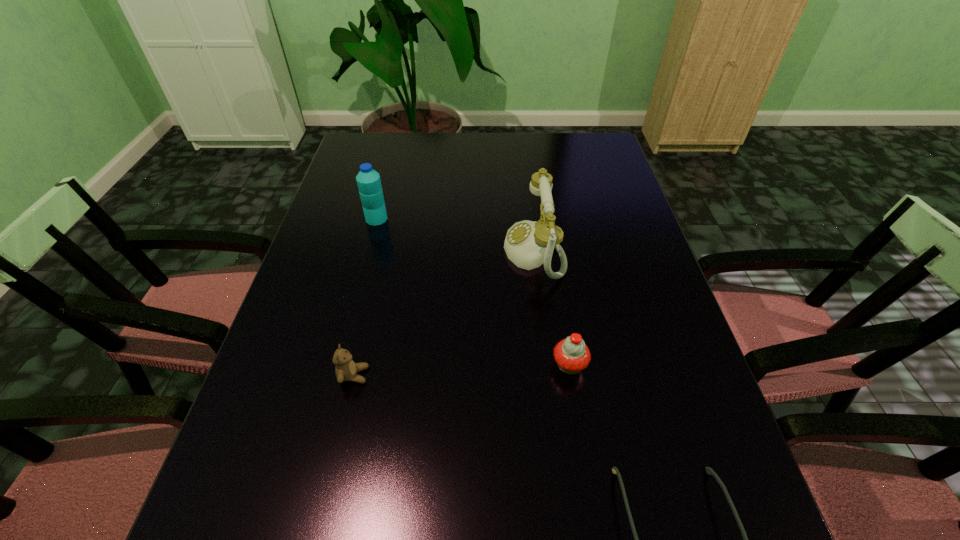
Image resolution: width=960 pixels, height=540 pixels. I want to click on water bottle that is positioned at the left edge, so click(x=368, y=180).

What are the coordinates of `teddy bear at the left edge` in the screenshot? It's located at (346, 369).

You are a GUI agent. You are given a task and a screenshot of the screen. Output one action in this format:
    pyautogui.click(x=<x>, y=<y>)
    Task: Click on the vacant space at the far edge of the desktop
    The image size is (960, 540).
    Given the screenshot: What is the action you would take?
    pyautogui.click(x=495, y=144)

The image size is (960, 540). Identify the location of free space at the left edge of the desktop. (353, 283).

The width and height of the screenshot is (960, 540). I want to click on vacant position at the right edge of the desktop, so point(621,193).

This screenshot has height=540, width=960. Find the location of `free spot at the far right corner of the desktop`. free spot at the far right corner of the desktop is located at coordinates (609, 168).

At what (x,y) coordinates should I click in order to perform the action: click on empty space that is in between the cupcake and the telephone. Please return your answer as a coordinate pair (x, y). Looking at the image, I should click on (552, 308).

This screenshot has width=960, height=540. Find the location of `free space between the teddy bear and the water bottle`. free space between the teddy bear and the water bottle is located at coordinates (365, 297).

Locate an element on the screen. The height and width of the screenshot is (540, 960). blank region between the telephone and the cupcake is located at coordinates click(x=552, y=308).

Locate an element on the screen. This screenshot has width=960, height=540. empty space that is in between the teddy bear and the water bottle is located at coordinates (365, 297).